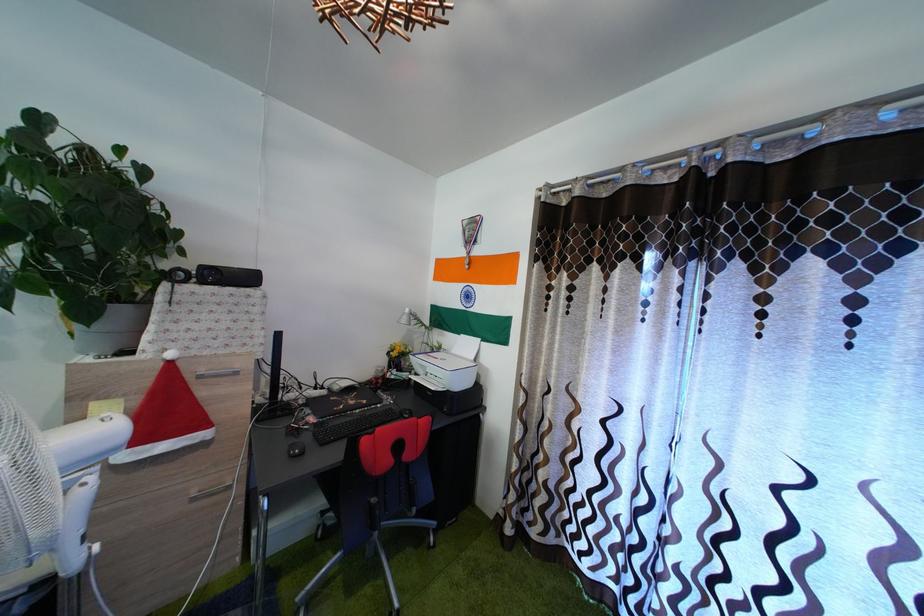
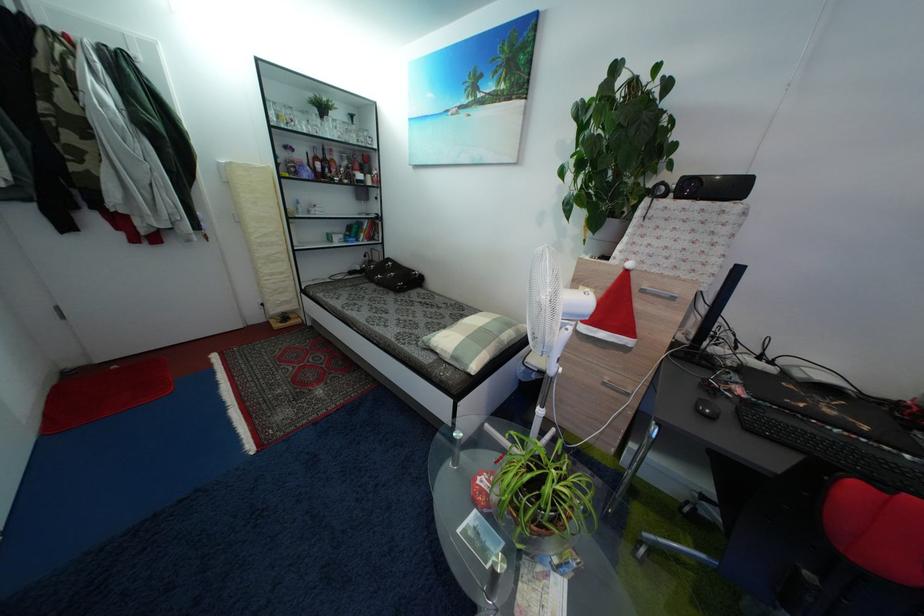
Consider the image. First-person continuous shooting, in which direction is the camera rotating?

The camera's rotation is toward left-down.